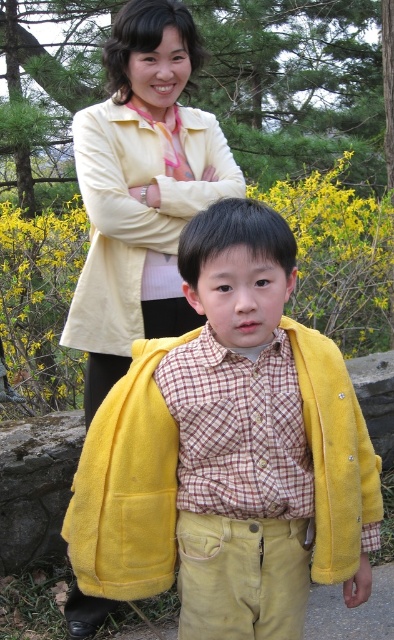
You are standing at the origin of a coordinate system placed at the bottom left corner of the image. You see a point at coordinate (230,451). What object is located at that point?

The point at coordinate (230,451) indicates the yellow fleece jacket at center.

You are trying to decide which yellow jacket to wear for a hike. You know that the yellow fleece jacket at center and the matte yellow jacket at upper center are both in your closet. Which one is wider?

The yellow fleece jacket at center is wider than the matte yellow jacket at upper center because its width surpasses the other.

You are a photographer trying to capture a group photo of the yellow fleece jacket at center and the matte yellow jacket at upper center. The camera you are using has a maximum focus range of 1 meter. Will both jackets be in focus?

The yellow fleece jacket at center is 1.14 meters away from the matte yellow jacket at upper center. Since the camera can only focus within 1 meter, the distance between them exceeds the focus range. Therefore, both jackets may not be in focus simultaneously.